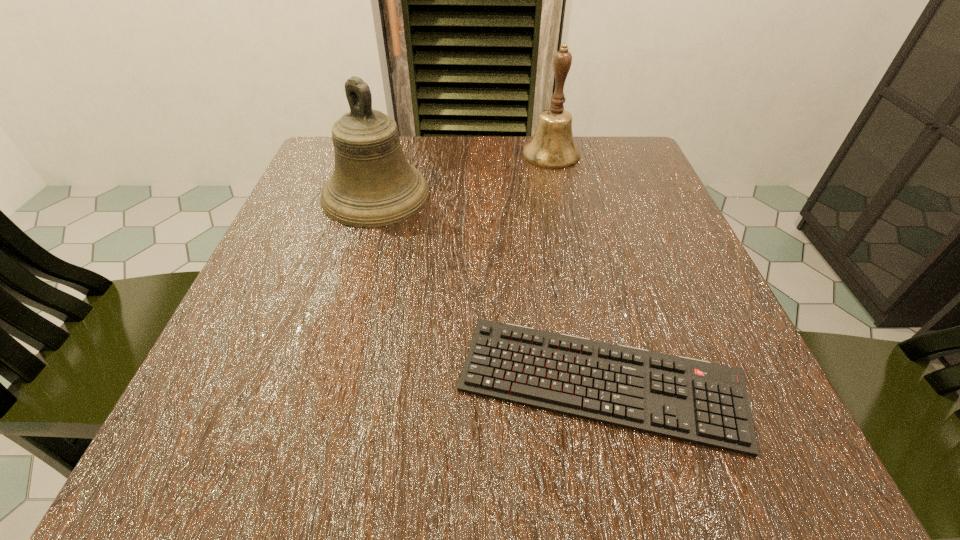
I want to click on computer keyboard present at the right edge, so click(691, 400).

Locate an element on the screen. object that is at the far left corner is located at coordinates (373, 185).

I want to click on object that is at the far right corner, so click(x=552, y=146).

What are the coordinates of `object at the near right corner` in the screenshot? It's located at (691, 400).

Find the location of `blank area at the far edge`. blank area at the far edge is located at coordinates (437, 137).

In order to click on vacant space at the near edge of the desktop in this screenshot , I will do `click(420, 458)`.

This screenshot has width=960, height=540. I want to click on free space at the left edge, so click(x=338, y=233).

Find the location of a particular element. The height and width of the screenshot is (540, 960). vacant space at the right edge is located at coordinates (625, 264).

In the image, there is a desktop. Identify the location of vacant area at the far right corner. (603, 138).

Find the location of a particular element. This screenshot has height=540, width=960. vacant area between the right bell and the left bell is located at coordinates (464, 174).